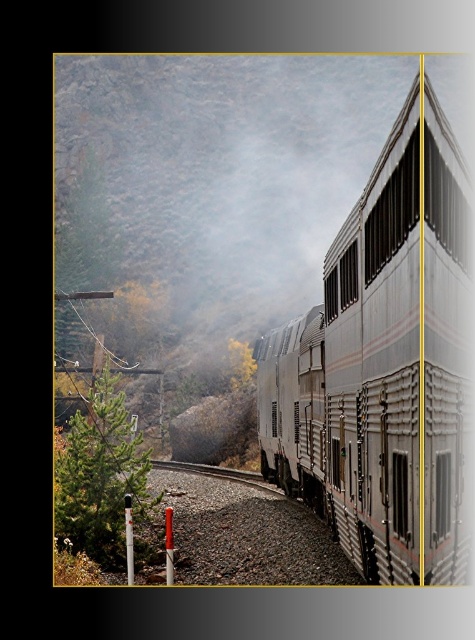
Question: Can you confirm if silver metallic train at center is positioned to the right of green matte tree at lower left?

Choices:
 (A) no
 (B) yes

Answer: (B)

Question: Is silver metallic train at center positioned behind green matte tree at lower left?

Choices:
 (A) no
 (B) yes

Answer: (A)

Question: Is silver metallic train at center below green matte tree at lower left?

Choices:
 (A) no
 (B) yes

Answer: (A)